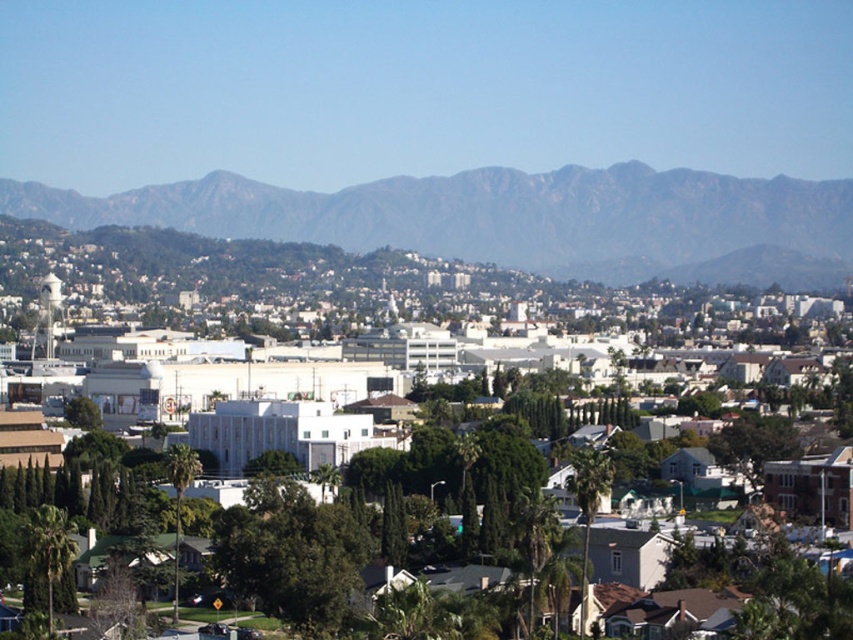
You are a landscape architect designing a new park in this city. You need to place a bench between the green leafy palm tree at center and the green leafy tree at lower left. Which tree should the bench be closer to if you want it to be near the wider tree?

The bench should be closer to the green leafy tree at lower left because it has a greater width than the green leafy palm tree at center.

You are standing in the cityscape and want to take a photo that includes both the green leafy palm tree at center and the green leafy tree at lower left. Which tree should you position closer to the center of your camera frame to ensure both are in the shot?

The green leafy palm tree at center is taller than the green leafy tree at lower left, so positioning the taller palm tree closer to the center of your camera frame will help ensure both are visible in the shot.

You are a drone operator trying to capture aerial footage of the city. Your drone is currently hovering above the white matte building at center. You need to fly it to the green leafy tree at lower left. Which direction should you steer the drone to reach the tree?

The white matte building at center is located above the green leafy tree at lower left, so you should steer the drone downward to reach the green leafy tree at lower left.